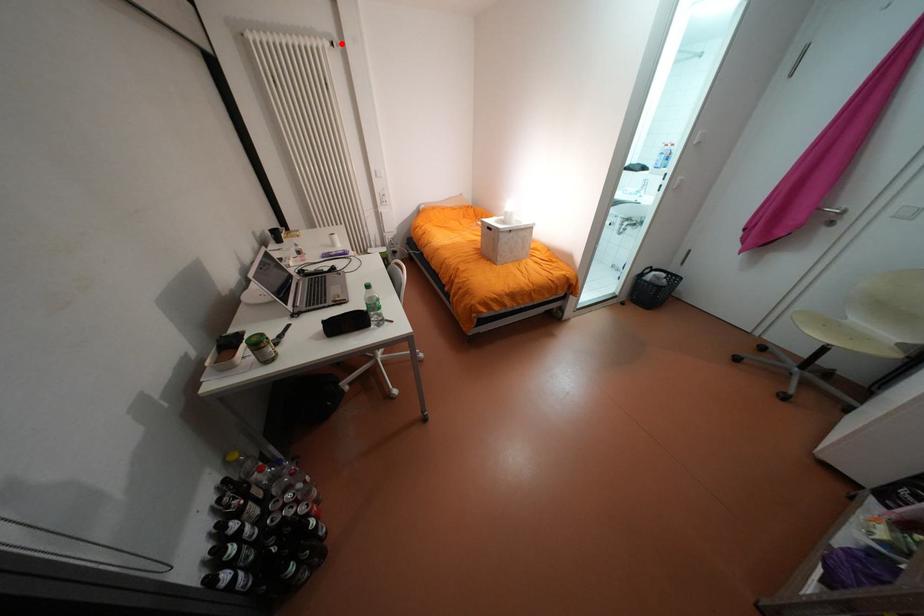
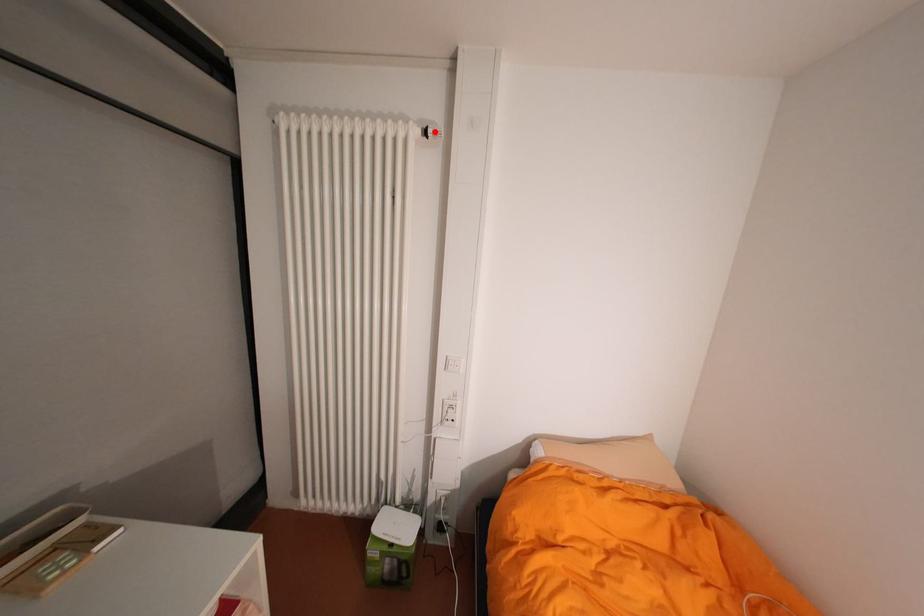
I am providing you with two images of the same scene from different viewpoints. A red point is marked on the first image and another point is marked on the second image. Do the highlighted points in image1 and image2 indicate the same real-world spot?

Yes